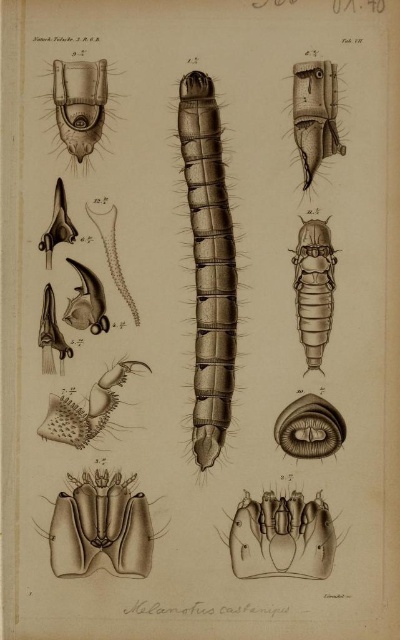
Is brown textured caterpillar at center further to the viewer compared to brown matte insect at center?

No, it is in front of brown matte insect at center.

Does brown textured caterpillar at center have a larger size compared to brown matte insect at center?

Indeed, brown textured caterpillar at center has a larger size compared to brown matte insect at center.

I want to click on brown textured caterpillar at center, so click(x=208, y=264).

Consider the image. Is brown textured caterpillar at center below matte black insect at upper left?

Indeed, brown textured caterpillar at center is positioned under matte black insect at upper left.

Is brown textured caterpillar at center closer to camera compared to matte black insect at upper left?

No, brown textured caterpillar at center is further to the viewer.

Which is behind, point (218, 156) or point (68, 88)?

Positioned behind is point (218, 156).

This screenshot has width=400, height=640. I want to click on brown textured caterpillar at center, so click(x=208, y=264).

Who is higher up, brown matte insect at center or matte black insect at upper left?

Positioned higher is matte black insect at upper left.

Is brown matte insect at center to the right of matte black insect at upper left from the viewer's perspective?

Correct, you'll find brown matte insect at center to the right of matte black insect at upper left.

Is point (324, 340) closer to viewer compared to point (79, 125)?

No.

This screenshot has height=640, width=400. In order to click on brown matte insect at center in this screenshot , I will do `click(314, 288)`.